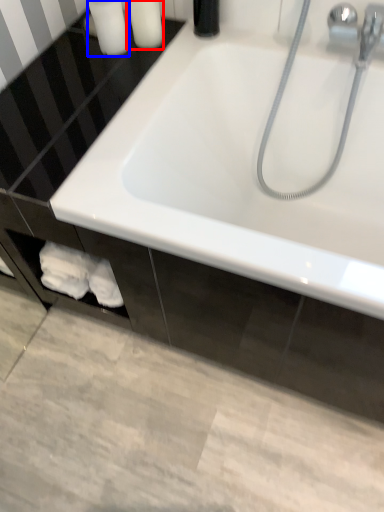
Question: Which of the following is the farthest to the observer, toiletry (highlighted by a red box) or toiletry (highlighted by a blue box)?

Choices:
 (A) toiletry
 (B) toiletry

Answer: (A)